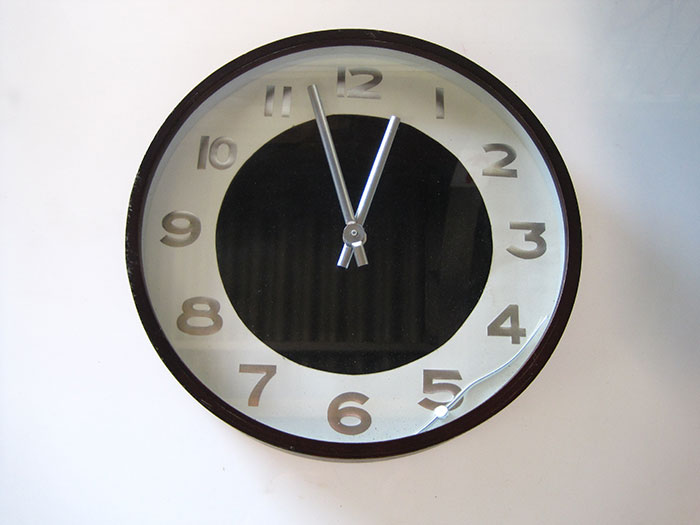
Where is `black frame around the clock`? black frame around the clock is located at coordinates (134, 205).